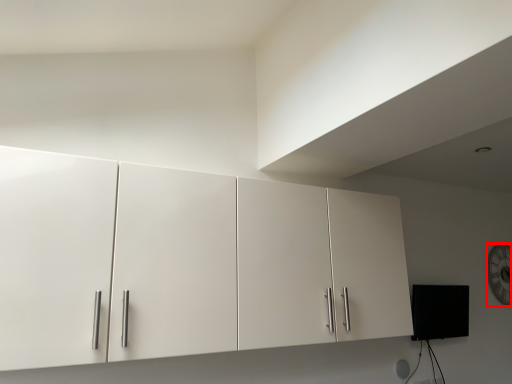
Question: From the image's perspective, where is clock (annotated by the red box) located relative to cupboard?

Choices:
 (A) below
 (B) above

Answer: (A)